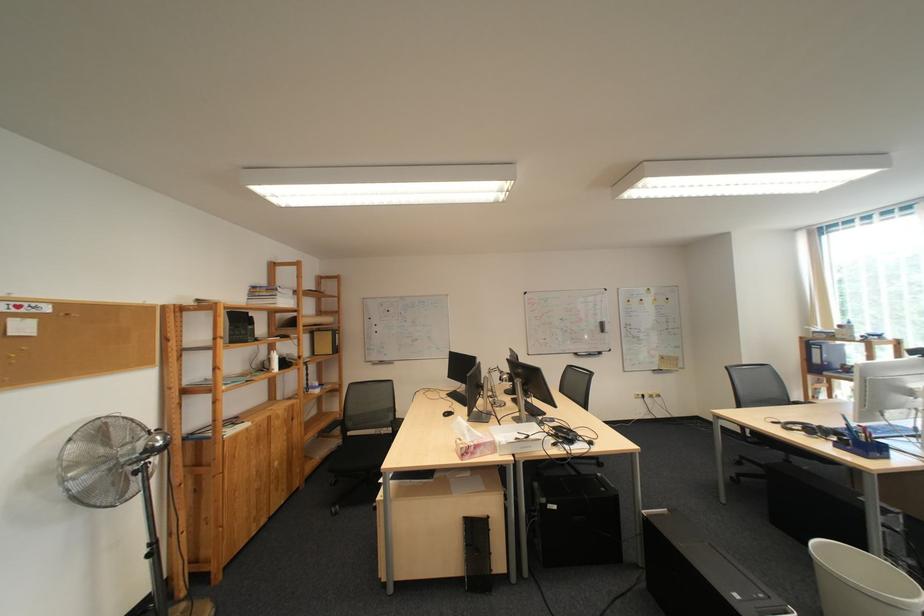
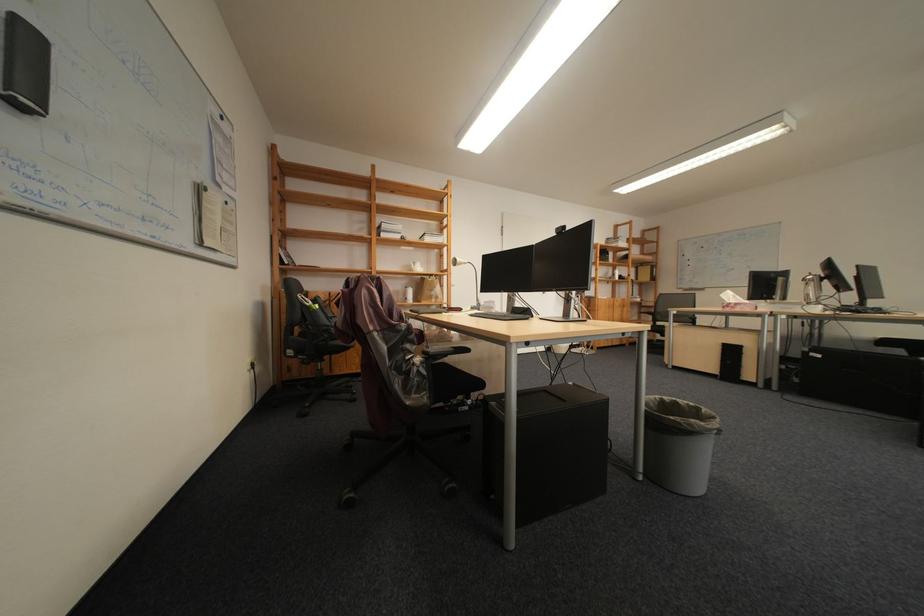
The point at (487,455) is marked in the first image. Where is the corresponding point in the second image?

(747, 309)